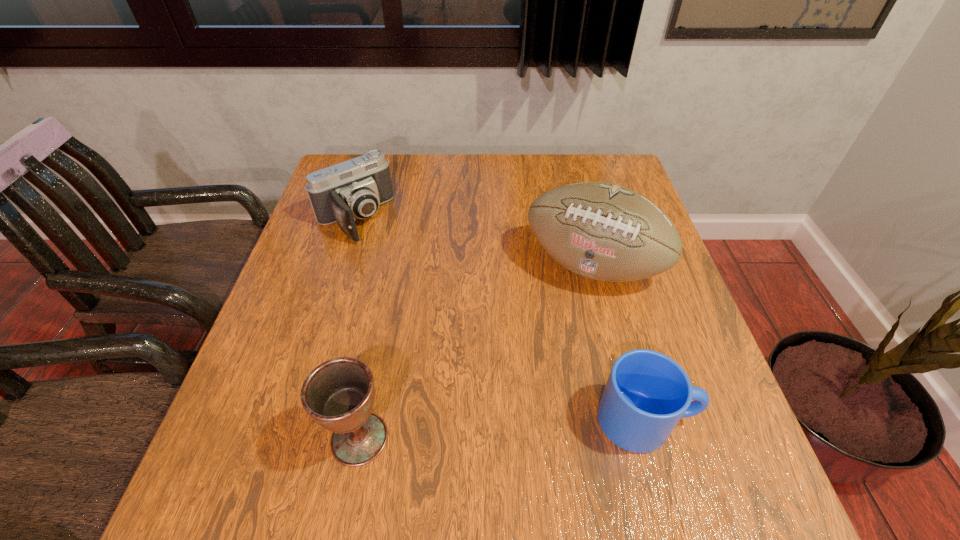
Locate an element on the screen. The height and width of the screenshot is (540, 960). free space on the desktop that is between the chalice and the mug and is positioned on the laces of the tallest object is located at coordinates (531, 427).

You are a GUI agent. You are given a task and a screenshot of the screen. Output one action in this format:
    pyautogui.click(x=<x>, y=<y>)
    Task: Click on the vacant space on the desktop that is between the chalice and the shortest object and is positioned at the front of the camera with an open lens cover
    
    Given the screenshot: What is the action you would take?
    pyautogui.click(x=531, y=427)